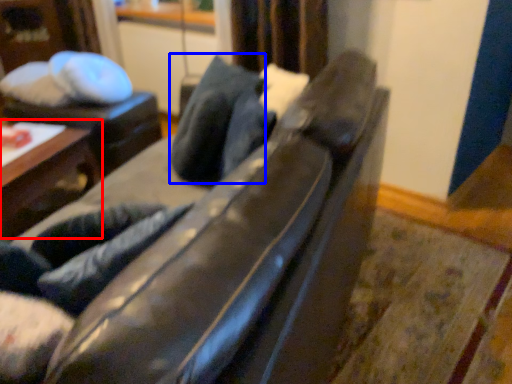
Question: Which object is closer to the camera taking this photo, table (highlighted by a red box) or pillow (highlighted by a blue box)?

Choices:
 (A) table
 (B) pillow

Answer: (B)